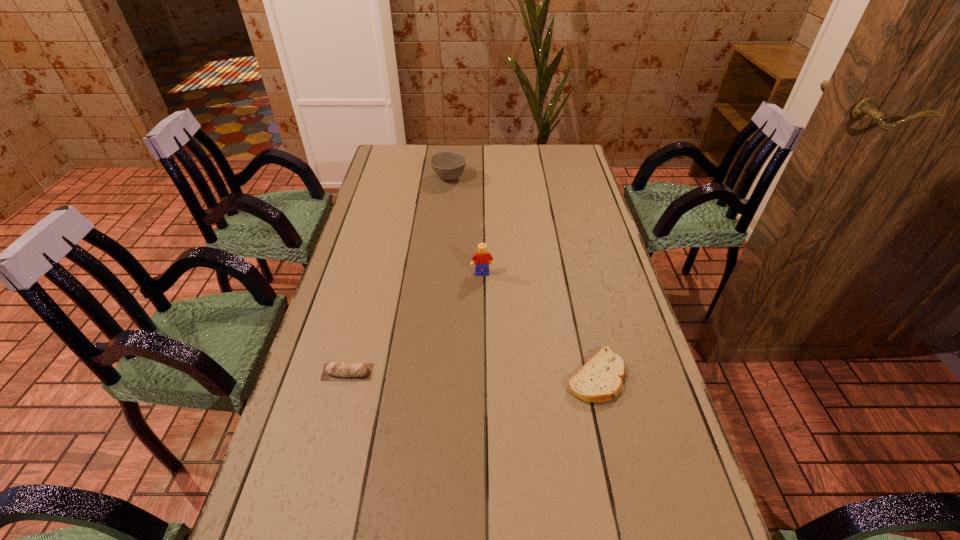
Locate an element on the screen. This screenshot has height=540, width=960. the tallest object is located at coordinates (482, 257).

Identify the location of the second farthest object. (482, 257).

Identify the location of the second tallest object. (449, 165).

At what (x,y) coordinates should I click in order to perform the action: click on bowl. Please return your answer as a coordinate pair (x, y). The image size is (960, 540). Looking at the image, I should click on (449, 165).

Find the location of a particular element. The image size is (960, 540). the leftmost object is located at coordinates (348, 371).

At what (x,y) coordinates should I click in order to perform the action: click on the rightmost object. Please return your answer as a coordinate pair (x, y). The height and width of the screenshot is (540, 960). Looking at the image, I should click on (601, 378).

You are a GUI agent. You are given a task and a screenshot of the screen. Output one action in this format:
    pyautogui.click(x=<x>, y=<y>)
    Task: Click on the shorter pita bread
    
    Given the screenshot: What is the action you would take?
    [x=601, y=378]

This screenshot has height=540, width=960. In order to click on vacant region located 0.370m on the face of the second object from right to left in this screenshot , I will do `click(483, 381)`.

Image resolution: width=960 pixels, height=540 pixels. What are the coordinates of `free space located 0.190m on the front of the third shortest object` in the screenshot? It's located at (445, 216).

The height and width of the screenshot is (540, 960). I want to click on vacant space located on the back of the leftmost object, so click(360, 324).